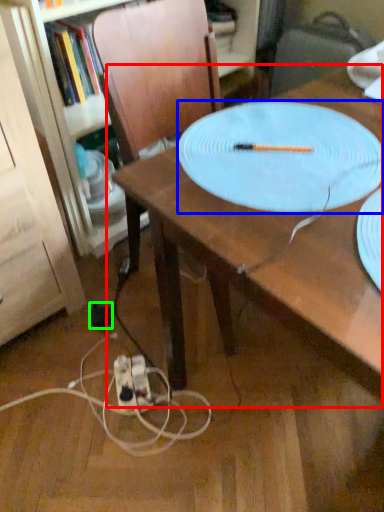
Question: Estimate the real-world distances between objects in this image. Which object is closer to table (highlighted by a red box), platter (highlighted by a blue box) or electric outlet (highlighted by a green box)?

Choices:
 (A) platter
 (B) electric outlet

Answer: (A)